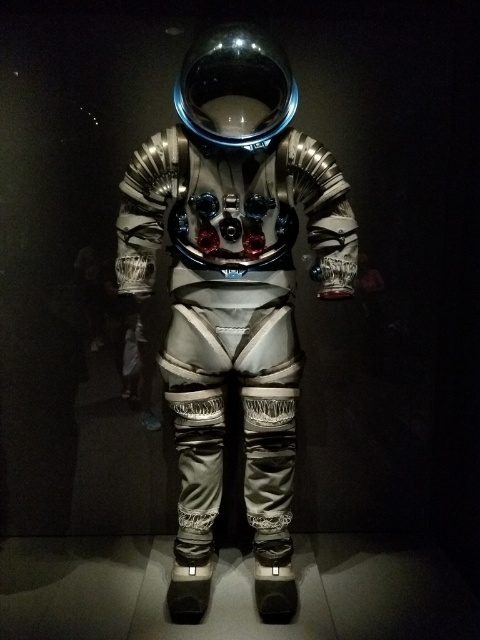
Consider the image. Who is positioned more to the left, silver metallic astronaut at center or glossy metallic helmet at upper center?

silver metallic astronaut at center

Who is higher up, silver metallic astronaut at center or glossy metallic helmet at upper center?

glossy metallic helmet at upper center is higher up.

Is point (346, 234) more distant than point (268, 131)?

Yes.

I want to click on silver metallic astronaut at center, so click(233, 291).